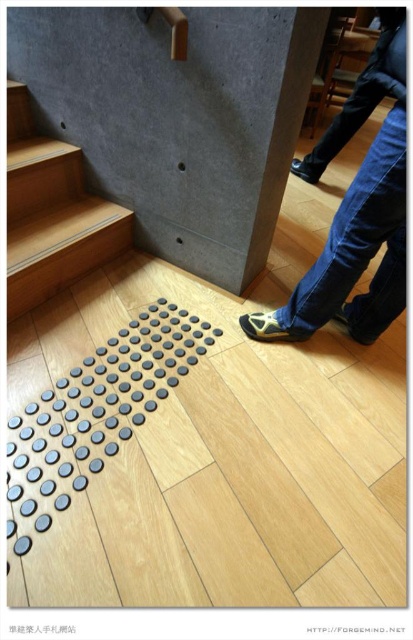
You are standing in the modern interior space and want to walk from the staircase to the concrete wall. There are two points marked on the floor, point (351,284) and point (14,230). Which point is closer to you as you face the staircase?

Point (351,284) is closer to the camera than point (14,230), so when facing the staircase, point (351,284) would be closer to you.

You are a delivery person who needs to place a small package on the floor. You see the denim jeans at lower right and the wooden at left. Which location has enough space to fit the package?

The denim jeans at lower right is larger in size than wooden at left, so the denim jeans at lower right has more space and can fit the package.

You are standing at the center of the room and see the denim jeans at lower right and the wooden at left. Which object is closer to your right side?

The denim jeans at lower right is closer to your right side because it is positioned to the right of the wooden at left.